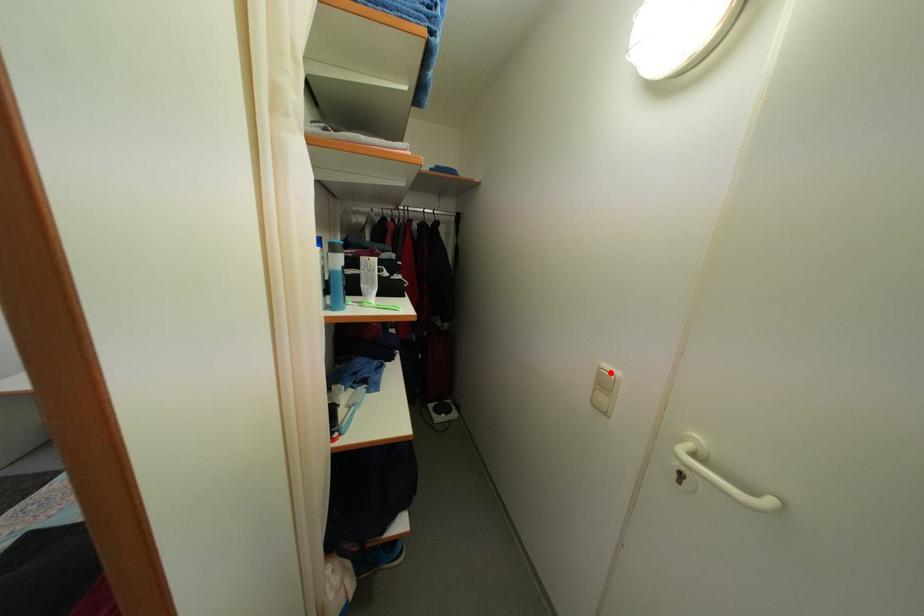
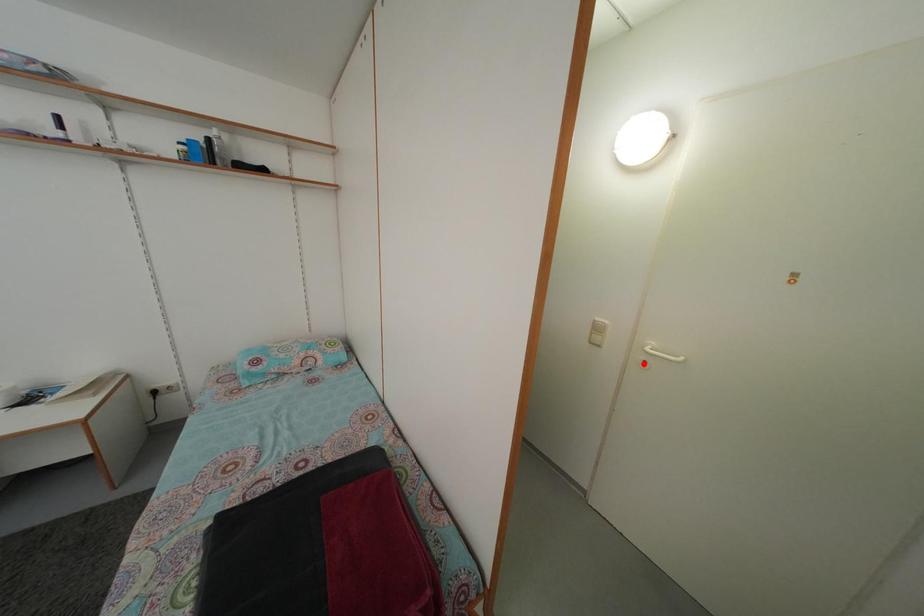
I am providing you with two images of the same scene from different viewpoints. A red point is marked on the first image and another point is marked on the second image. Is the marked point in image1 the same physical position as the marked point in image2?

No